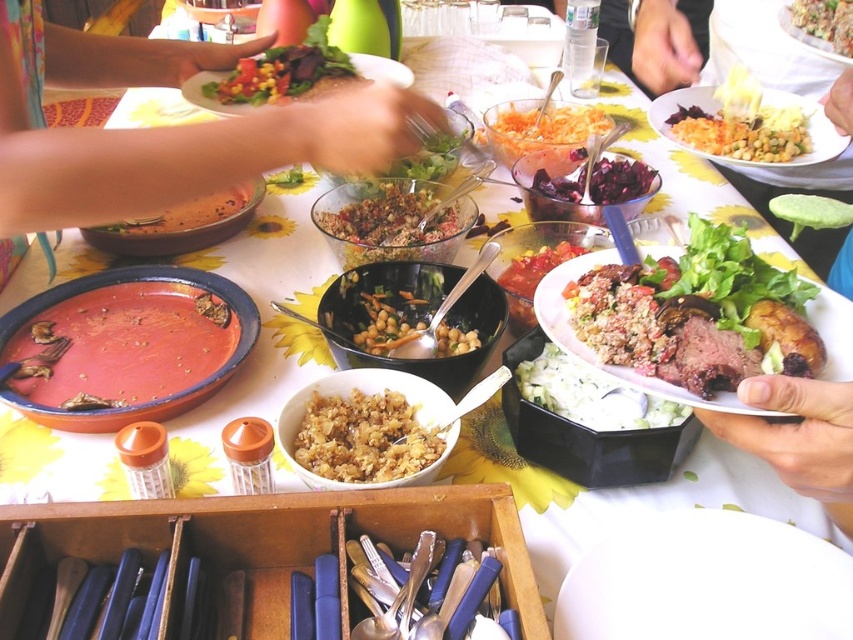
From the picture: Who is taller, tomato-based sauce at center or green leafy salad at upper center?

With more height is green leafy salad at upper center.

Does tomato-based sauce at center have a greater width compared to green leafy salad at upper center?

No.

Does point (532, 269) come in front of point (378, 80)?

Yes, it is in front of point (378, 80).

The image size is (853, 640). What are the coordinates of `tomato-based sauce at center` in the screenshot? It's located at (531, 280).

Describe the element at coordinates (706, 580) in the screenshot. I see `white matte plate at center` at that location.

Based on the photo, can you confirm if white matte plate at center is taller than green leafy salad at upper center?

Incorrect, white matte plate at center's height is not larger of green leafy salad at upper center's.

Between point (642, 608) and point (383, 68), which one is positioned in front?

Point (642, 608) is in front.

Locate an element on the screen. white matte plate at center is located at coordinates (706, 580).

From the picture: Is brown matte rice bowl at center taller than vibrant mixed salad at center?

No, brown matte rice bowl at center is not taller than vibrant mixed salad at center.

Where is `brown matte rice bowl at center`? The width and height of the screenshot is (853, 640). brown matte rice bowl at center is located at coordinates (363, 436).